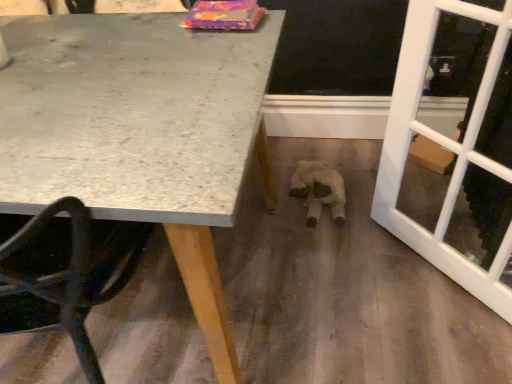
Question: Does white glass screen door at right lie behind white plush toy at center?

Choices:
 (A) yes
 (B) no

Answer: (B)

Question: Could you tell me if white glass screen door at right is facing white plush toy at center?

Choices:
 (A) no
 (B) yes

Answer: (A)

Question: Considering the relative positions of white glass screen door at right and white plush toy at center in the image provided, is white glass screen door at right to the right of white plush toy at center from the viewer's perspective?

Choices:
 (A) yes
 (B) no

Answer: (A)

Question: Is white glass screen door at right positioned before white plush toy at center?

Choices:
 (A) no
 (B) yes

Answer: (B)

Question: Does white glass screen door at right have a smaller size compared to white plush toy at center?

Choices:
 (A) no
 (B) yes

Answer: (A)

Question: Would you consider white glass screen door at right to be distant from white plush toy at center?

Choices:
 (A) no
 (B) yes

Answer: (A)

Question: Is white plush toy at center closer to the viewer compared to granite table at upper left?

Choices:
 (A) no
 (B) yes

Answer: (A)

Question: Does white plush toy at center have a greater height compared to granite table at upper left?

Choices:
 (A) yes
 (B) no

Answer: (B)

Question: Considering the relative sizes of white plush toy at center and granite table at upper left in the image provided, is white plush toy at center smaller than granite table at upper left?

Choices:
 (A) no
 (B) yes

Answer: (B)

Question: Would you say white plush toy at center is outside granite table at upper left?

Choices:
 (A) no
 (B) yes

Answer: (B)

Question: Does white plush toy at center have a lesser width compared to granite table at upper left?

Choices:
 (A) yes
 (B) no

Answer: (A)

Question: Can you confirm if white plush toy at center is positioned to the left of granite table at upper left?

Choices:
 (A) no
 (B) yes

Answer: (A)

Question: Is white glass screen door at right positioned far away from granite table at upper left?

Choices:
 (A) no
 (B) yes

Answer: (A)